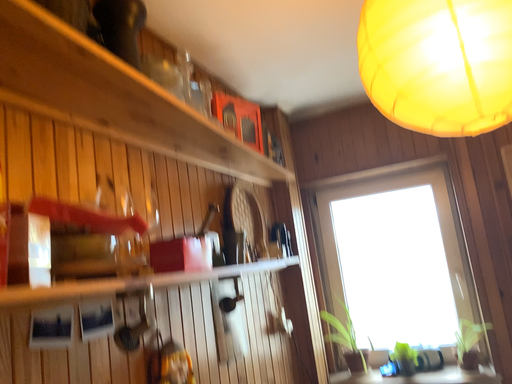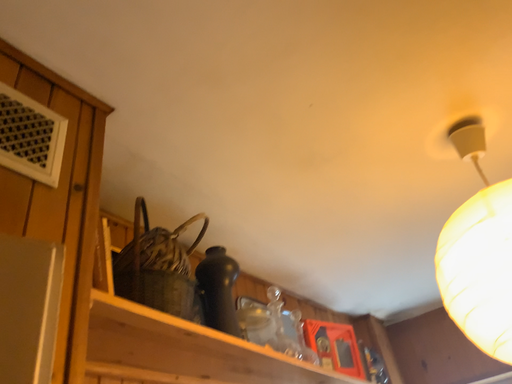
Question: How did the camera likely rotate when shooting the video?

Choices:
 (A) rotated left
 (B) rotated right

Answer: (A)